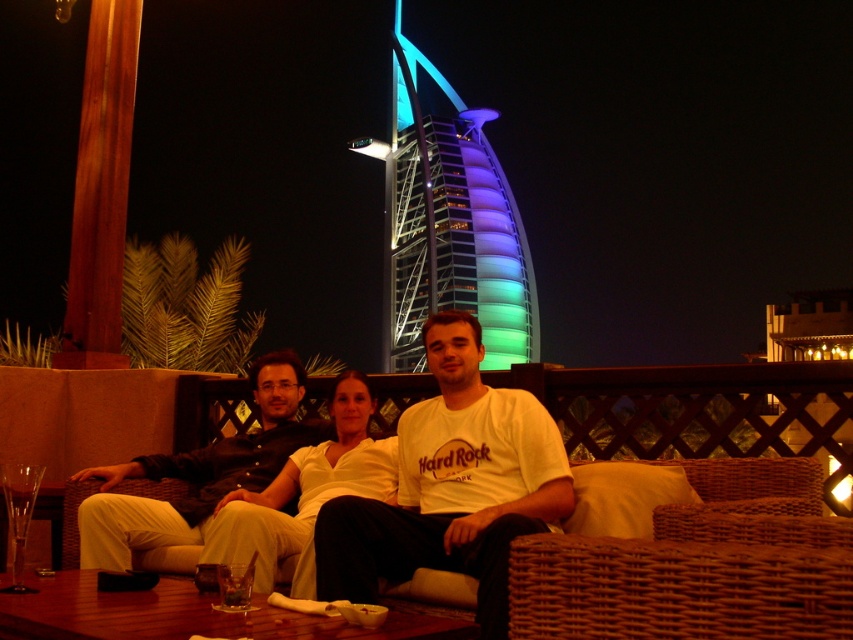
Question: Is multicolored glass tower at center positioned in front of wooden pole at left?

Choices:
 (A) no
 (B) yes

Answer: (A)

Question: Can you confirm if white cotton shirt at center is positioned above wooden pole at left?

Choices:
 (A) no
 (B) yes

Answer: (A)

Question: Which is nearer to the light beige fabric couch at center?

Choices:
 (A) white cotton shirt at center
 (B) clear glass wine glass at lower left

Answer: (A)

Question: Does wooden pole at left appear over white matte shirt at center?

Choices:
 (A) no
 (B) yes

Answer: (B)

Question: Among these points, which one is farthest from the camera?

Choices:
 (A) (164, 536)
 (B) (372, 468)
 (C) (16, 557)
 (D) (64, 317)

Answer: (D)

Question: Which point is closer to the camera?

Choices:
 (A) light beige fabric couch at center
 (B) white matte shirt at center

Answer: (B)